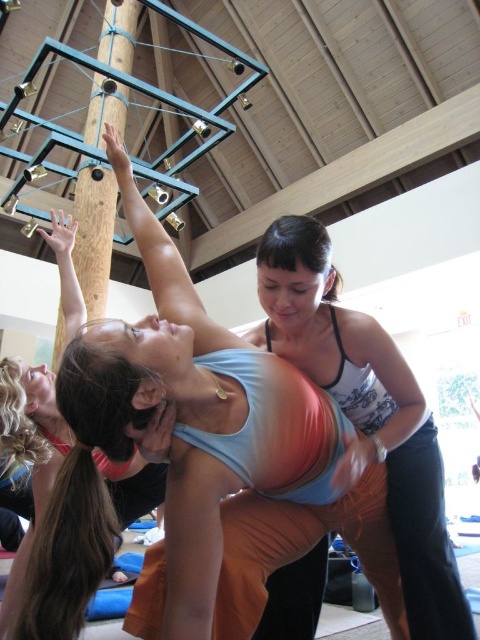
Question: Which point appears closest to the camera in this image?

Choices:
 (A) (292, 420)
 (B) (80, 296)

Answer: (A)

Question: Among these points, which one is nearest to the camera?

Choices:
 (A) (173, 563)
 (B) (299, 570)
 (C) (51, 237)

Answer: (A)

Question: Which point is closer to the camera?

Choices:
 (A) matte black tank top at center
 (B) matte pink tank top at upper left

Answer: (B)

Question: Is matte blue tank top at center to the left of matte black tank top at center from the viewer's perspective?

Choices:
 (A) no
 (B) yes

Answer: (B)

Question: Does matte black tank top at center have a smaller size compared to matte pink tank top at upper left?

Choices:
 (A) no
 (B) yes

Answer: (B)

Question: Is matte black tank top at center to the right of matte pink tank top at upper left from the viewer's perspective?

Choices:
 (A) no
 (B) yes

Answer: (B)